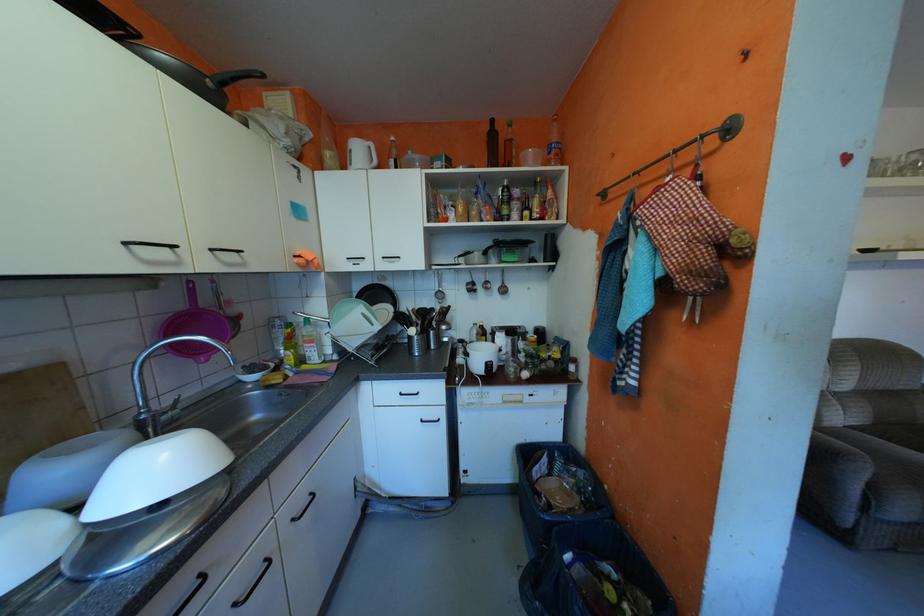
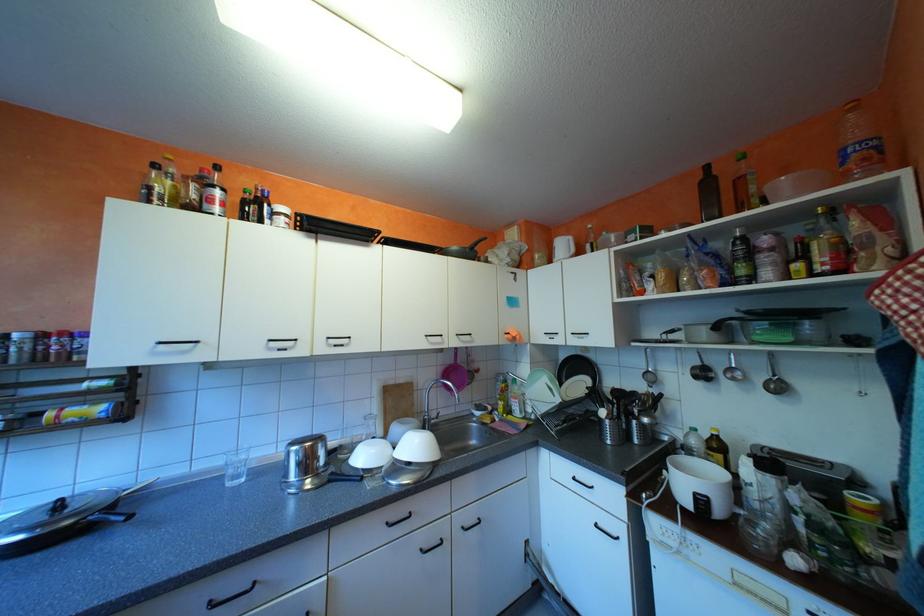
Locate, in the second image, the point that corresponds to point (487, 286) in the first image.

(723, 374)